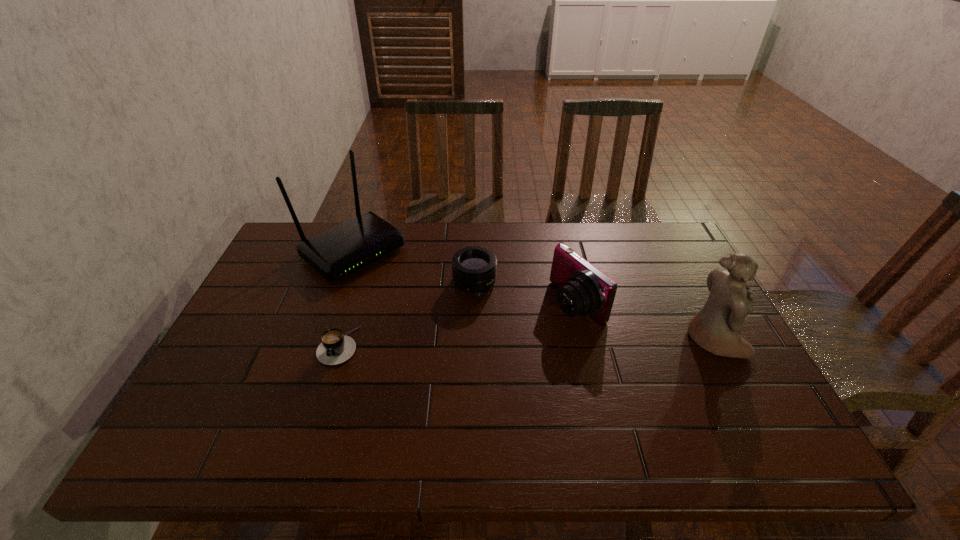
Identify the location of cappuccino. The height and width of the screenshot is (540, 960). [x=335, y=348].

This screenshot has height=540, width=960. I want to click on figurine, so click(716, 327).

Where is `the second shortest object`? The width and height of the screenshot is (960, 540). the second shortest object is located at coordinates (474, 269).

I want to click on the third object from left to right, so click(474, 269).

Locate an element on the screen. The height and width of the screenshot is (540, 960). camera is located at coordinates (582, 289).

Where is `the third tallest object`? The width and height of the screenshot is (960, 540). the third tallest object is located at coordinates (582, 289).

Find the location of a particular element. router is located at coordinates coord(336,253).

At what (x,y) coordinates should I click in order to perform the action: click on free spot located on the side of the third object from right to left with brand markings and control switches. Please return your answer as a coordinate pair (x, y). Looking at the image, I should click on (512, 417).

You are a GUI agent. You are given a task and a screenshot of the screen. Output one action in this format:
    pyautogui.click(x=<x>, y=<y>)
    Task: Click on the free space located on the side of the third object from right to left with brand markings and control switches
    This screenshot has height=540, width=960.
    Given the screenshot: What is the action you would take?
    pyautogui.click(x=497, y=367)

In order to click on vacant region located 0.350m on the side of the third object from right to left with brand markings and control switches in this screenshot , I will do `click(507, 401)`.